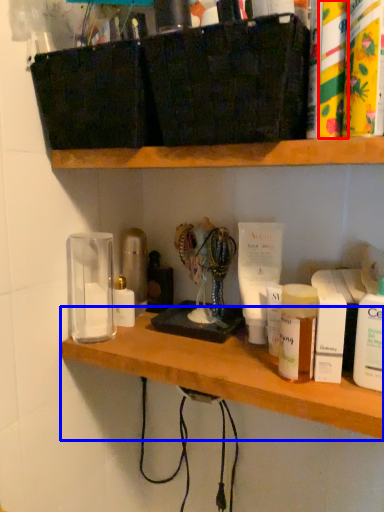
Question: Which of the following is the closest to the observer, toiletry (highlighted by a red box) or shelf (highlighted by a blue box)?

Choices:
 (A) toiletry
 (B) shelf

Answer: (A)